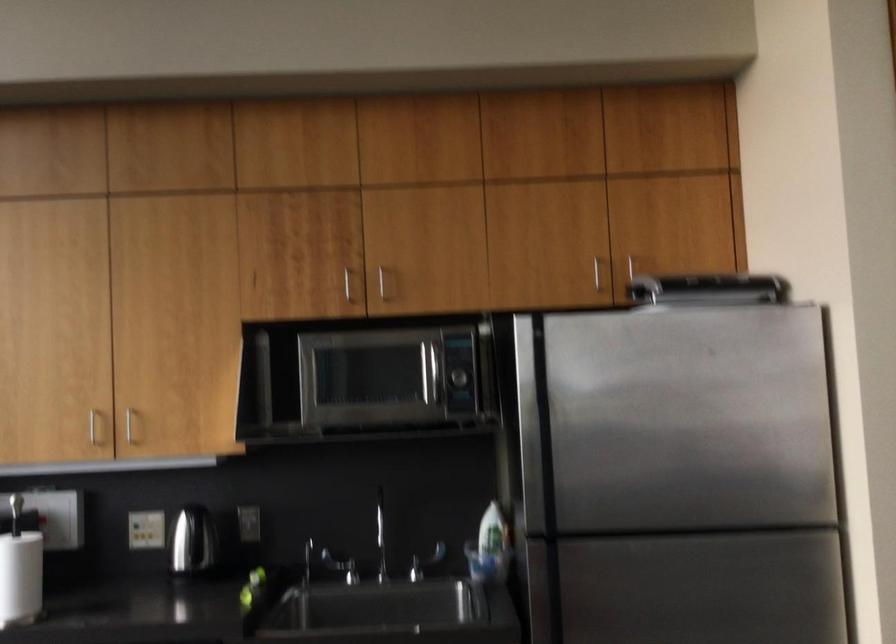
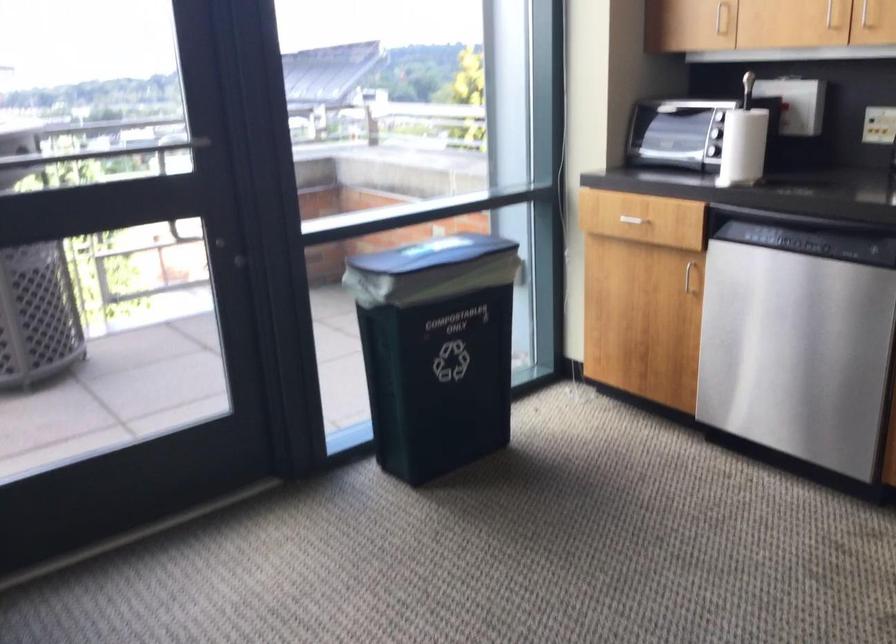
Where in the second image is the point corresponding to pixel 124 431 from the first image?

(865, 15)